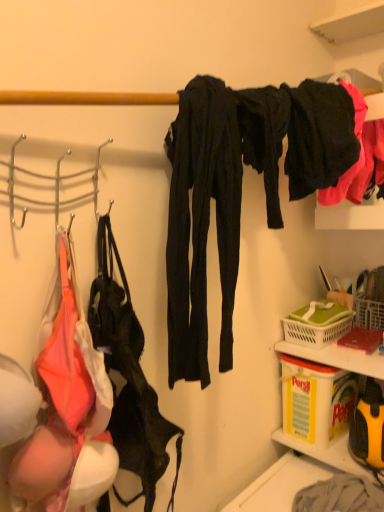
The image size is (384, 512). What do you see at coordinates (338, 357) in the screenshot?
I see `yellow plastic container at lower right` at bounding box center [338, 357].

What is the approximate height of matte black pants at center, acting as the 2th clothing starting from the right?

64.50 centimeters.

This screenshot has height=512, width=384. I want to click on yellow plastic container at lower right, so point(338,357).

Does black matte pants at upper right, the first clothing from the right, turn towards leather-like black handbag at left?

No, black matte pants at upper right, the first clothing from the right, does not turn towards leather-like black handbag at left.

Is black matte pants at upper right, the first clothing from the right, located outside leather-like black handbag at left?

Yes, black matte pants at upper right, the first clothing from the right, is located beyond the bounds of leather-like black handbag at left.

Considering the points (332, 127) and (110, 292), which point is behind, point (332, 127) or point (110, 292)?

The point (332, 127) is farther.

Is black matte pants at upper right, the second clothing from the left, shorter than leather-like black handbag at left?

Yes.

What's the angular difference between black matte pants at upper right, the second clothing from the left, and matte black pants at center, acting as the 2th clothing starting from the right,'s facing directions?

0.000189 degrees.

Is point (340, 150) closer to camera compared to point (237, 120)?

No, it is not.

Visually, is black matte pants at upper right, the second clothing from the left, positioned to the left or to the right of matte black pants at center, acting as the 2th clothing starting from the right?

In the image, black matte pants at upper right, the second clothing from the left, appears on the right side of matte black pants at center, acting as the 2th clothing starting from the right.

From the image's perspective, would you say matte black pants at center, which is counted as the 1th clothing, starting from the left, is positioned over leather-like black handbag at left?

Correct, matte black pants at center, which is counted as the 1th clothing, starting from the left, appears higher than leather-like black handbag at left in the image.

From a real-world perspective, between matte black pants at center, acting as the 2th clothing starting from the right, and leather-like black handbag at left, who is vertically higher?

matte black pants at center, acting as the 2th clothing starting from the right, is physically above.

Choose the correct answer: Is matte black pants at center, acting as the 2th clothing starting from the right, inside leather-like black handbag at left or outside it?

matte black pants at center, acting as the 2th clothing starting from the right, exists outside the volume of leather-like black handbag at left.

How distant is matte black pants at center, acting as the 2th clothing starting from the right, from leather-like black handbag at left?

A distance of 6.85 inches exists between matte black pants at center, acting as the 2th clothing starting from the right, and leather-like black handbag at left.

From a real-world perspective, which is physically below, yellow plastic container at lower right or black matte pants at upper right, the first clothing from the right?

yellow plastic container at lower right.

Between yellow plastic container at lower right and black matte pants at upper right, the first clothing from the right, which one appears on the right side from the viewer's perspective?

yellow plastic container at lower right is more to the right.

In terms of width, does yellow plastic container at lower right look wider or thinner when compared to black matte pants at upper right, the first clothing from the right?

Clearly, yellow plastic container at lower right has more width compared to black matte pants at upper right, the first clothing from the right.

Considering the relative sizes of yellow plastic container at lower right and black matte pants at upper right, the first clothing from the right, in the image provided, is yellow plastic container at lower right taller than black matte pants at upper right, the first clothing from the right,?

In fact, yellow plastic container at lower right may be shorter than black matte pants at upper right, the first clothing from the right.

Is matte black pants at center, acting as the 2th clothing starting from the right, at the right side of green plastic basket at lower right?

In fact, matte black pants at center, acting as the 2th clothing starting from the right, is to the left of green plastic basket at lower right.

Can you tell me how much matte black pants at center, which is counted as the 1th clothing, starting from the left, and green plastic basket at lower right differ in facing direction?

The angular difference between matte black pants at center, which is counted as the 1th clothing, starting from the left, and green plastic basket at lower right is 91 degrees.

In the scene shown: Is matte black pants at center, which is counted as the 1th clothing, starting from the left, in front of or behind green plastic basket at lower right in the image?

Visually, matte black pants at center, which is counted as the 1th clothing, starting from the left, is located in front of green plastic basket at lower right.

Is matte black pants at center, which is counted as the 1th clothing, starting from the left, outside of green plastic basket at lower right?

matte black pants at center, which is counted as the 1th clothing, starting from the left, is positioned outside green plastic basket at lower right.

From the image's perspective, is matte black pants at center, which is counted as the 1th clothing, starting from the left, positioned above or below black matte pants at upper right, the second clothing from the left?

matte black pants at center, which is counted as the 1th clothing, starting from the left, is below black matte pants at upper right, the second clothing from the left.

Is matte black pants at center, acting as the 2th clothing starting from the right, beside black matte pants at upper right, the first clothing from the right?

No, matte black pants at center, acting as the 2th clothing starting from the right, is not next to black matte pants at upper right, the first clothing from the right.

Could you tell me if matte black pants at center, which is counted as the 1th clothing, starting from the left, is facing black matte pants at upper right, the first clothing from the right?

No, matte black pants at center, which is counted as the 1th clothing, starting from the left, is not aimed at black matte pants at upper right, the first clothing from the right.

How much distance is there between matte black pants at center, acting as the 2th clothing starting from the right, and black matte pants at upper right, the first clothing from the right?

matte black pants at center, acting as the 2th clothing starting from the right, is 12.70 inches from black matte pants at upper right, the first clothing from the right.

From the image's perspective, is yellow plastic container at lower right beneath leather-like black handbag at left?

Yes, from the image's perspective, yellow plastic container at lower right is below leather-like black handbag at left.

Is leather-like black handbag at left at the back of yellow plastic container at lower right?

No, yellow plastic container at lower right is not facing the opposite direction of leather-like black handbag at left.

Can leather-like black handbag at left be found inside yellow plastic container at lower right?

Actually, leather-like black handbag at left is outside yellow plastic container at lower right.

Locate an element on the screen. This screenshot has width=384, height=512. the 2nd clothing behind when counting from the leather-like black handbag at left is located at coordinates (321, 136).

Where is `clothing in front of the black matte pants at upper right, the second clothing from the left`? clothing in front of the black matte pants at upper right, the second clothing from the left is located at coordinates (202, 223).

Which object lies nearer to the anchor point leather-like black handbag at left, yellow plastic container at lower right or green plastic basket at lower right?

yellow plastic container at lower right lies closer to leather-like black handbag at left than the other object.

Which object lies further to the anchor point leather-like black handbag at left, matte black pants at center, acting as the 2th clothing starting from the right, or yellow plastic container at lower right?

yellow plastic container at lower right.

Looking at the image, which one is located further to leather-like black handbag at left, green plastic basket at lower right or black matte pants at upper right, the first clothing from the right?

green plastic basket at lower right lies further to leather-like black handbag at left than the other object.

Estimate the real-world distances between objects in this image. Which object is further from black matte pants at upper right, the second clothing from the left, leather-like black handbag at left or green plastic basket at lower right?

Among the two, leather-like black handbag at left is located further to black matte pants at upper right, the second clothing from the left.

When comparing their distances from green plastic basket at lower right, does black matte pants at upper right, the first clothing from the right, or matte black pants at center, which is counted as the 1th clothing, starting from the left, seem further?

matte black pants at center, which is counted as the 1th clothing, starting from the left, is further to green plastic basket at lower right.

Looking at the image, which one is located further to matte black pants at center, which is counted as the 1th clothing, starting from the left, black matte pants at upper right, the second clothing from the left, or yellow plastic container at lower right?

yellow plastic container at lower right is positioned further to the anchor matte black pants at center, which is counted as the 1th clothing, starting from the left.

Which object lies nearer to the anchor point green plastic basket at lower right, matte black pants at center, which is counted as the 1th clothing, starting from the left, or yellow plastic container at lower right?

Based on the image, yellow plastic container at lower right appears to be nearer to green plastic basket at lower right.

Considering their positions, is yellow plastic container at lower right positioned further to matte black pants at center, which is counted as the 1th clothing, starting from the left, than green plastic basket at lower right?

yellow plastic container at lower right.

Identify the location of clothing that lies between black matte pants at upper right, the second clothing from the left, and yellow plastic container at lower right from top to bottom. (202, 223).

Locate an element on the screen. Image resolution: width=384 pixels, height=512 pixels. basket between matte black pants at center, which is counted as the 1th clothing, starting from the left, and yellow plastic container at lower right vertically is located at coordinates (315, 331).

I want to click on basket that lies between black matte pants at upper right, the first clothing from the right, and yellow plastic container at lower right from top to bottom, so click(x=315, y=331).

Identify the location of clothing between black matte pants at upper right, the second clothing from the left, and leather-like black handbag at left vertically. This screenshot has height=512, width=384. (202, 223).